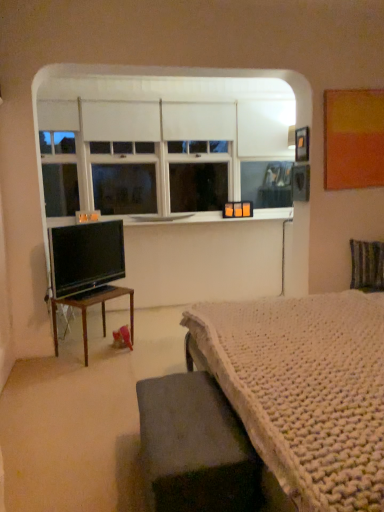
I want to click on vacant area that is in front of wooden table at left, which is counted as the first table, starting from the left, so click(84, 375).